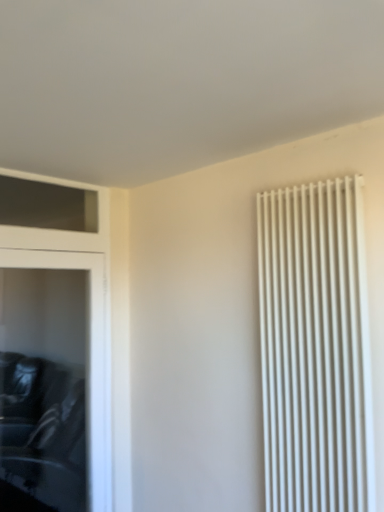
What do you see at coordinates (90, 315) in the screenshot? I see `black leather dresser at left` at bounding box center [90, 315].

Find the location of a particular element. This screenshot has width=384, height=512. black leather dresser at left is located at coordinates (90, 315).

What do you see at coordinates (315, 348) in the screenshot?
I see `white matte radiator at right` at bounding box center [315, 348].

Locate an element on the screen. Image resolution: width=384 pixels, height=512 pixels. white matte radiator at right is located at coordinates click(315, 348).

What is the approximate height of white matte radiator at right?

white matte radiator at right is 1.59 meters in height.

Where is `black leather dresser at left`? This screenshot has width=384, height=512. black leather dresser at left is located at coordinates (90, 315).

Based on their positions, is black leather dresser at left located to the left or right of white matte radiator at right?

In the image, black leather dresser at left appears on the left side of white matte radiator at right.

In the image, is black leather dresser at left positioned in front of or behind white matte radiator at right?

black leather dresser at left is behind white matte radiator at right.

Is point (98, 207) less distant than point (313, 197)?

No, (98, 207) is behind (313, 197).

From the image's perspective, which one is positioned lower, black leather dresser at left or white matte radiator at right?

black leather dresser at left.

From a real-world perspective, is black leather dresser at left positioned above or below white matte radiator at right?

Clearly, from a real-world perspective, black leather dresser at left is below white matte radiator at right.

Can you confirm if black leather dresser at left is wider than white matte radiator at right?

No, black leather dresser at left is not wider than white matte radiator at right.

Who is taller, black leather dresser at left or white matte radiator at right?

Standing taller between the two is black leather dresser at left.

Which of these two, black leather dresser at left or white matte radiator at right, is bigger?

black leather dresser at left.

Is black leather dresser at left not inside white matte radiator at right?

Yes, black leather dresser at left is located beyond the bounds of white matte radiator at right.

Is there a large distance between black leather dresser at left and white matte radiator at right?

black leather dresser at left is far away from white matte radiator at right.

Is black leather dresser at left looking in the opposite direction of white matte radiator at right?

No, black leather dresser at left's orientation is not away from white matte radiator at right.

How different are the orientations of black leather dresser at left and white matte radiator at right in degrees?

They differ by 88.5 degrees in their facing directions.

In the image, there is a white matte radiator at right. Where is `dresser below it (from the image's perspective)`? The height and width of the screenshot is (512, 384). dresser below it (from the image's perspective) is located at coordinates (90, 315).

Looking at this image, is white matte radiator at right to the left of black leather dresser at left from the viewer's perspective?

No, white matte radiator at right is not to the left of black leather dresser at left.

Between white matte radiator at right and black leather dresser at left, which one is positioned in front?

white matte radiator at right is closer to the camera.

Does point (345, 189) come in front of point (83, 188)?

Yes.

From the image's perspective, is white matte radiator at right beneath black leather dresser at left?

Incorrect, from the image's perspective, white matte radiator at right is higher than black leather dresser at left.

From a real-world perspective, is white matte radiator at right on black leather dresser at left?

Yes, from a real-world perspective, white matte radiator at right is on top of black leather dresser at left.

Which object is thinner, white matte radiator at right or black leather dresser at left?

With smaller width is black leather dresser at left.

Considering the relative sizes of white matte radiator at right and black leather dresser at left in the image provided, is white matte radiator at right shorter than black leather dresser at left?

Indeed, white matte radiator at right has a lesser height compared to black leather dresser at left.

From the picture: Which of these two, white matte radiator at right or black leather dresser at left, is smaller?

white matte radiator at right is smaller.

Is white matte radiator at right inside or outside of black leather dresser at left?

white matte radiator at right lies outside black leather dresser at left.

Is white matte radiator at right next to black leather dresser at left and touching it?

white matte radiator at right and black leather dresser at left are clearly separated.

From the picture: Is white matte radiator at right facing towards black leather dresser at left?

No, white matte radiator at right is not oriented towards black leather dresser at left.

How many degrees apart are the facing directions of white matte radiator at right and black leather dresser at left?

The angle between the facing direction of white matte radiator at right and the facing direction of black leather dresser at left is 88.5 degrees.

This screenshot has width=384, height=512. What are the coordinates of `dresser to the left of white matte radiator at right` in the screenshot? It's located at (90, 315).

Identify the location of dresser below the white matte radiator at right (from the image's perspective). (90, 315).

Locate an element on the screen. This screenshot has width=384, height=512. dresser that appears below the white matte radiator at right (from a real-world perspective) is located at coordinates (90, 315).